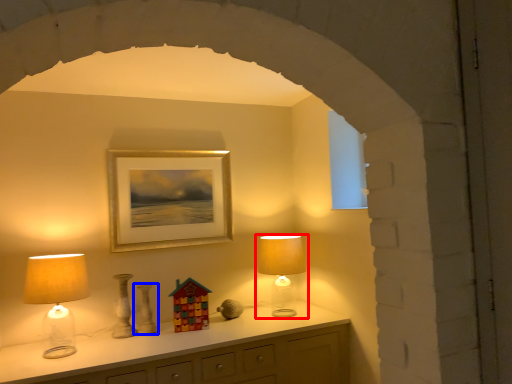
Question: Among these objects, which one is nearest to the camera, lamp (highlighted by a red box) or vase (highlighted by a blue box)?

Choices:
 (A) lamp
 (B) vase

Answer: (B)